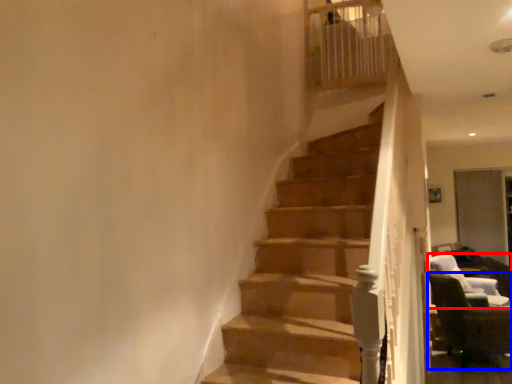
Question: Which object appears closest to the camera in this image, chair (highlighted by a red box) or chair (highlighted by a blue box)?

Choices:
 (A) chair
 (B) chair

Answer: (B)